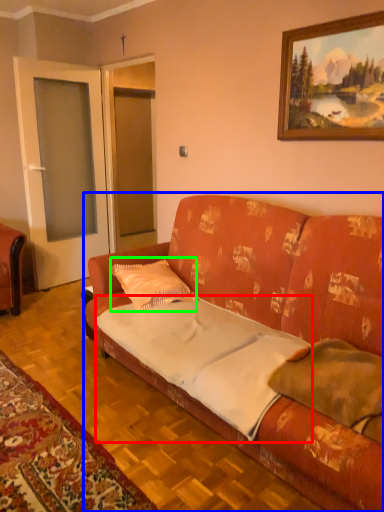
Question: Estimate the real-world distances between objects in this image. Which object is farther from sheet (highlighted by a red box), studio couch (highlighted by a blue box) or pillow (highlighted by a green box)?

Choices:
 (A) studio couch
 (B) pillow

Answer: (B)